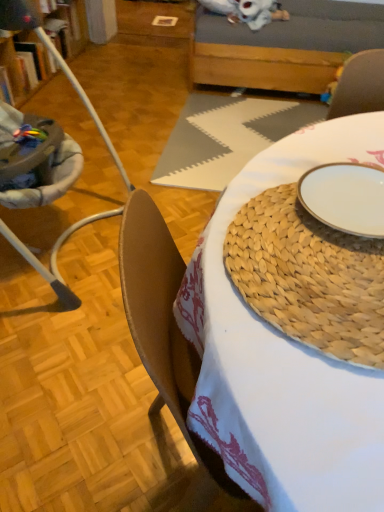
Locate an element on the screen. vacant space behind brown leather chair at left is located at coordinates (128, 152).